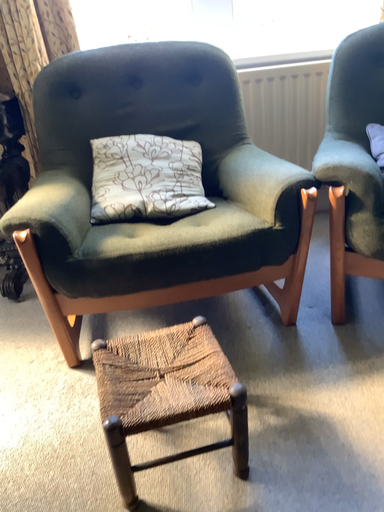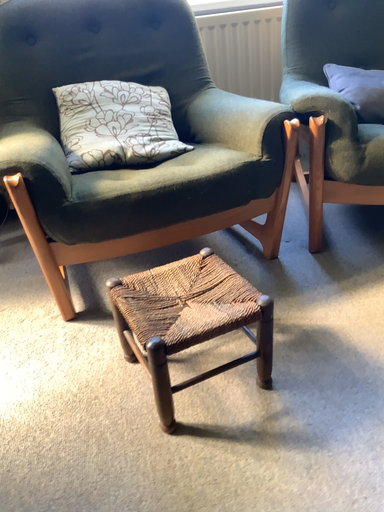
Question: How did the camera likely rotate when shooting the video?

Choices:
 (A) rotated right
 (B) rotated left

Answer: (A)